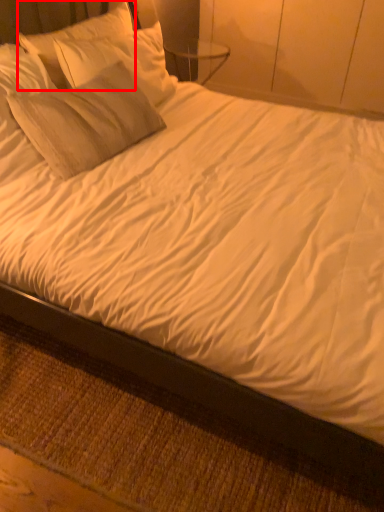
Question: Observing the image, what is the correct spatial positioning of pillow (annotated by the red box) in reference to bed frame?

Choices:
 (A) right
 (B) left

Answer: (B)